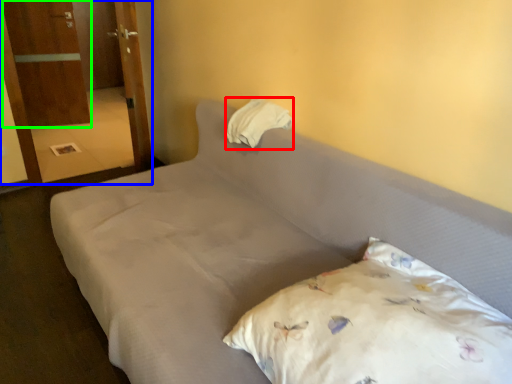
Question: Which object is the farthest from pillow (highlighted by a red box)? Choose among these: armoire (highlighted by a blue box) or armoire (highlighted by a green box).

Choices:
 (A) armoire
 (B) armoire

Answer: (B)